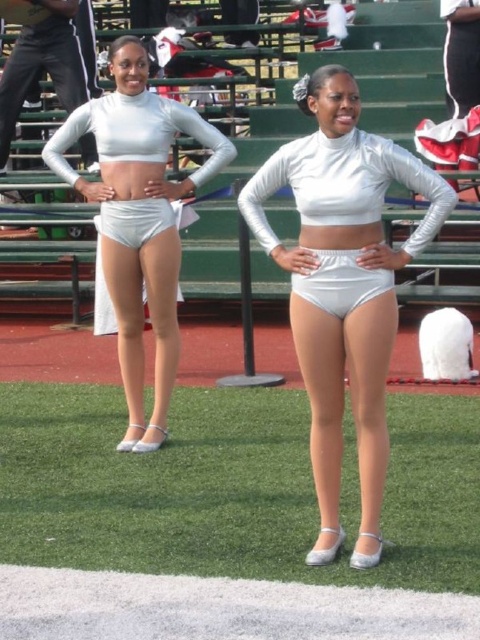
Can you confirm if silver metallic shorts at center is shorter than white matte shorts at center?

Incorrect, silver metallic shorts at center's height does not fall short of white matte shorts at center's.

Identify the location of silver metallic shorts at center. (139, 220).

Is point (369, 387) more distant than point (439, 364)?

No, it is not.

How far apart are silver shiny shorts at center and white matte shorts at center?

silver shiny shorts at center and white matte shorts at center are 9.34 feet apart from each other.

Between point (325, 305) and point (445, 364), which one is positioned behind?

The point (445, 364) is behind.

At what (x,y) coordinates should I click in order to perform the action: click on silver shiny shorts at center. Please return your answer as a coordinate pair (x, y). The width and height of the screenshot is (480, 640). Looking at the image, I should click on (343, 285).

Does silver shiny shorts at center appear on the right side of silver metallic shorts at center?

Correct, you'll find silver shiny shorts at center to the right of silver metallic shorts at center.

Can you confirm if silver shiny shorts at center is positioned above silver metallic shorts at center?

No, silver shiny shorts at center is not above silver metallic shorts at center.

Is point (374, 442) positioned behind point (101, 221)?

No, (374, 442) is closer to viewer.

Locate an element on the screen. The height and width of the screenshot is (640, 480). silver shiny shorts at center is located at coordinates (343, 285).